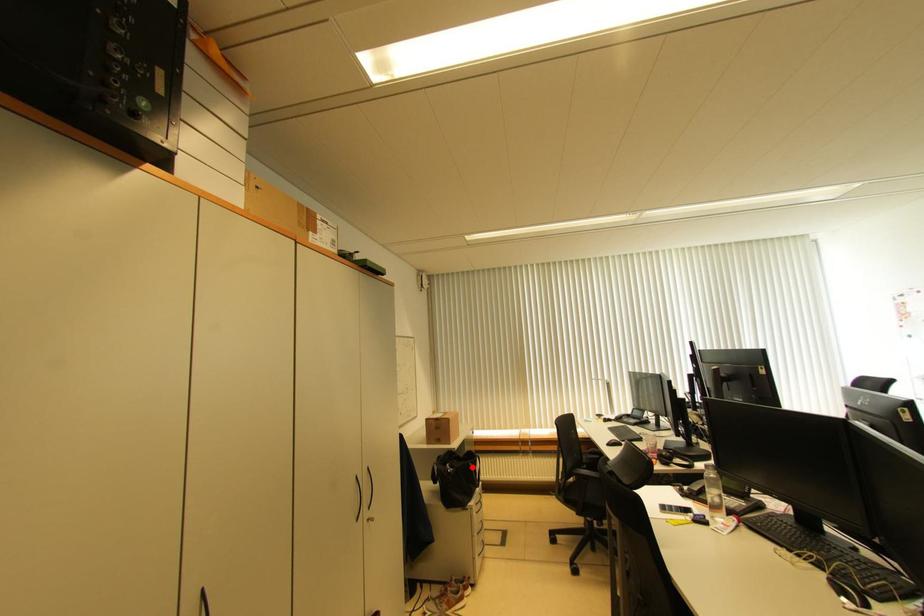
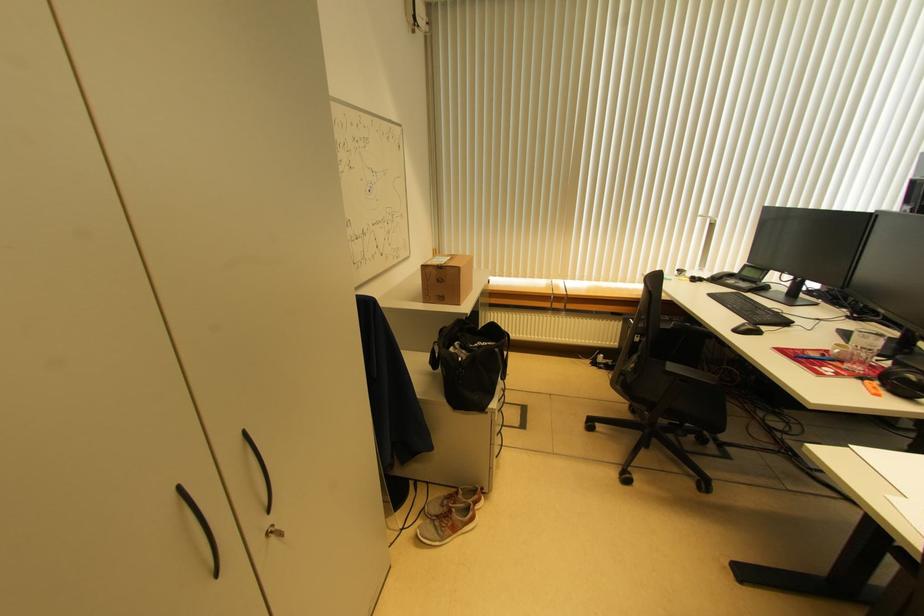
Question: I am providing you with two images of the same scene from different viewpoints. In image1, a red point is highlighted. Considering the same 3D point in image2, which of the following is correct?

Choices:
 (A) It is closer
 (B) It is farther

Answer: (B)